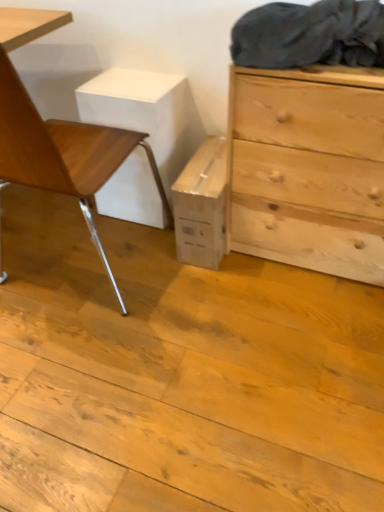
Question: Considering the positions of natural wood chest of drawers at right and dark gray fabric at upper right in the image, is natural wood chest of drawers at right bigger or smaller than dark gray fabric at upper right?

Choices:
 (A) small
 (B) big

Answer: (B)

Question: From a real-world perspective, relative to dark gray fabric at upper right, is natural wood chest of drawers at right vertically above or below?

Choices:
 (A) below
 (B) above

Answer: (A)

Question: Based on their relative distances, which object is nearer to the dark gray fabric at upper right?

Choices:
 (A) natural wood chest of drawers at right
 (B) wooden chair at left

Answer: (A)

Question: Which object is the farthest from the wooden chair at left?

Choices:
 (A) dark gray fabric at upper right
 (B) natural wood chest of drawers at right

Answer: (A)